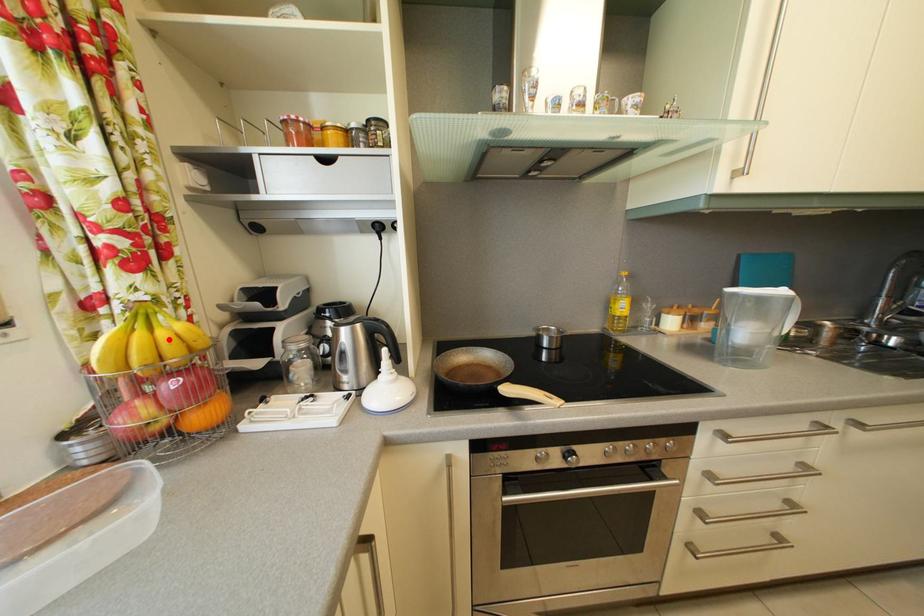
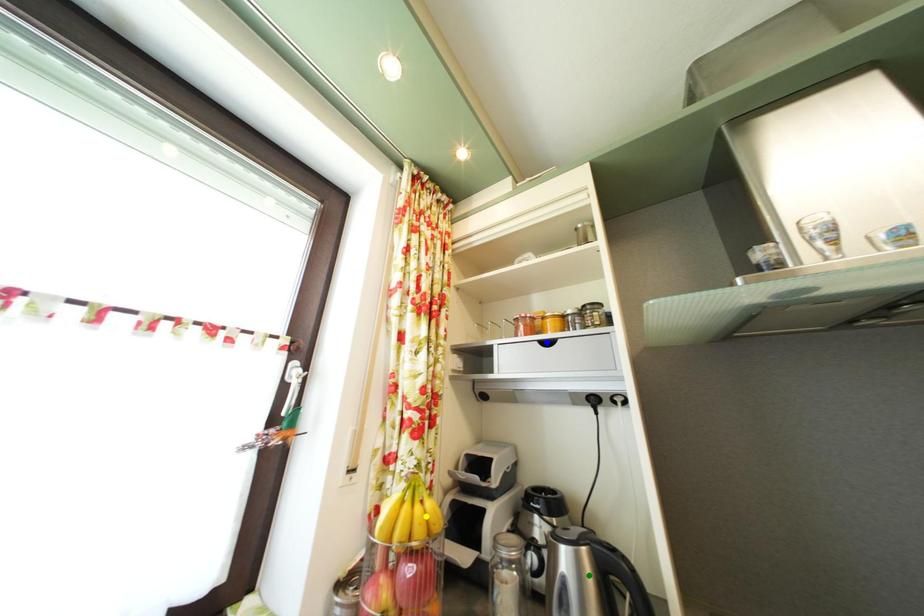
Question: I am providing you with two images of the same scene from different viewpoints. A red point is marked on the first image. You are given multiple points on the second image. Which point in image 2 represents the same 3d spot as the red point in image 1?

Choices:
 (A) yellow point
 (B) blue point
 (C) green point

Answer: (A)